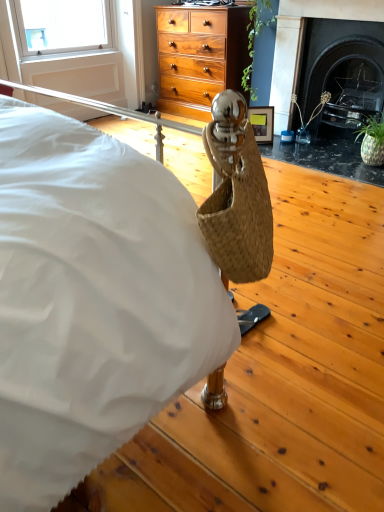
Locate an element on the screen. vacant region in front of clear glass vase at right, positioned as the second plant in left-to-right order is located at coordinates (309, 148).